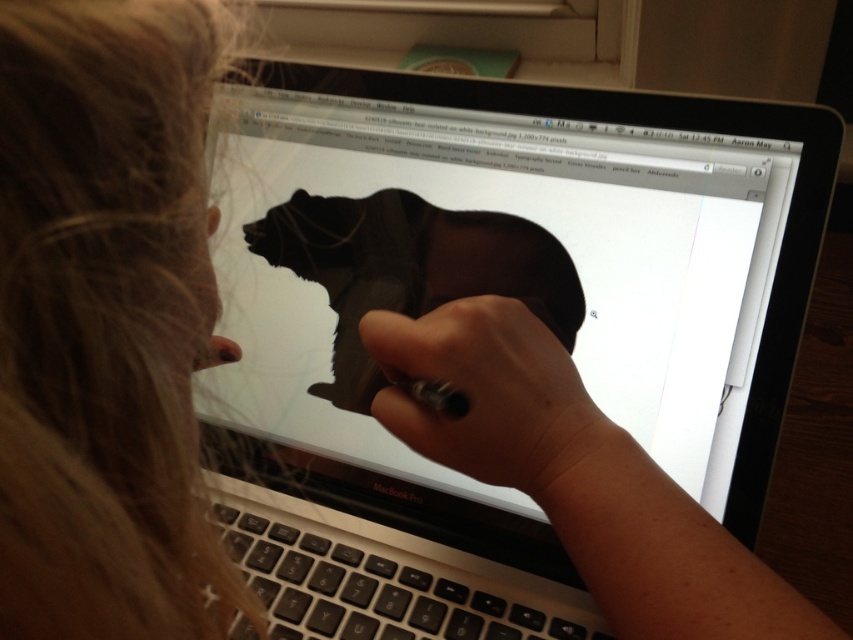
Question: Does shiny black bear at center appear on the left side of black matte pen at center?

Choices:
 (A) no
 (B) yes

Answer: (B)

Question: Estimate the real-world distances between objects in this image. Which object is farther from the black matte pen at center?

Choices:
 (A) blonde hair at upper left
 (B) shiny black bear at center

Answer: (A)

Question: Which point is farther to the camera?

Choices:
 (A) black matte bear at center
 (B) blonde hair at upper left
 (C) shiny black bear at center
 (D) black matte pen at center

Answer: (A)

Question: Which point is farther from the camera taking this photo?

Choices:
 (A) (467, 452)
 (B) (558, 280)

Answer: (B)

Question: Does blonde hair at upper left have a greater width compared to shiny black bear at center?

Choices:
 (A) yes
 (B) no

Answer: (B)

Question: Is the position of black matte bear at center more distant than that of blonde hair at upper left?

Choices:
 (A) yes
 (B) no

Answer: (A)